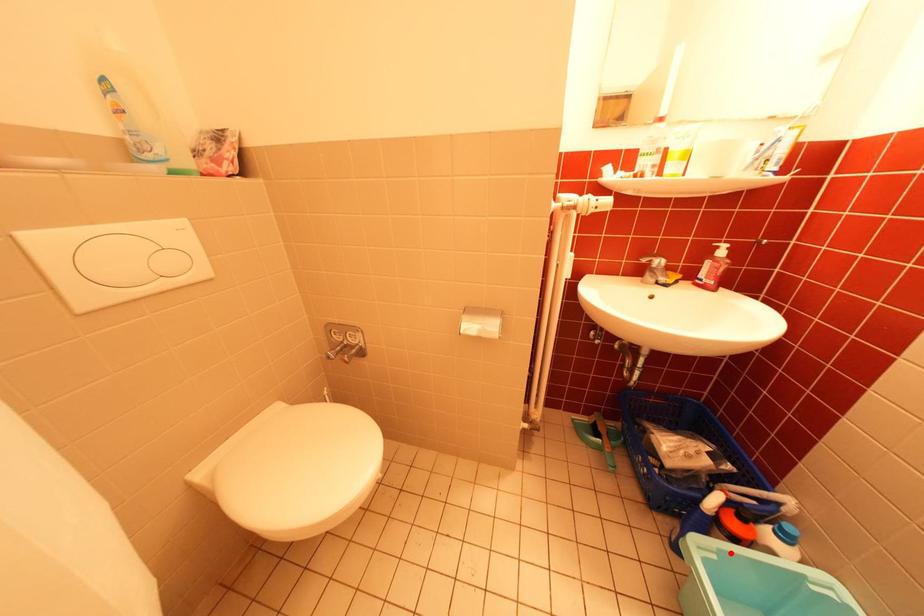
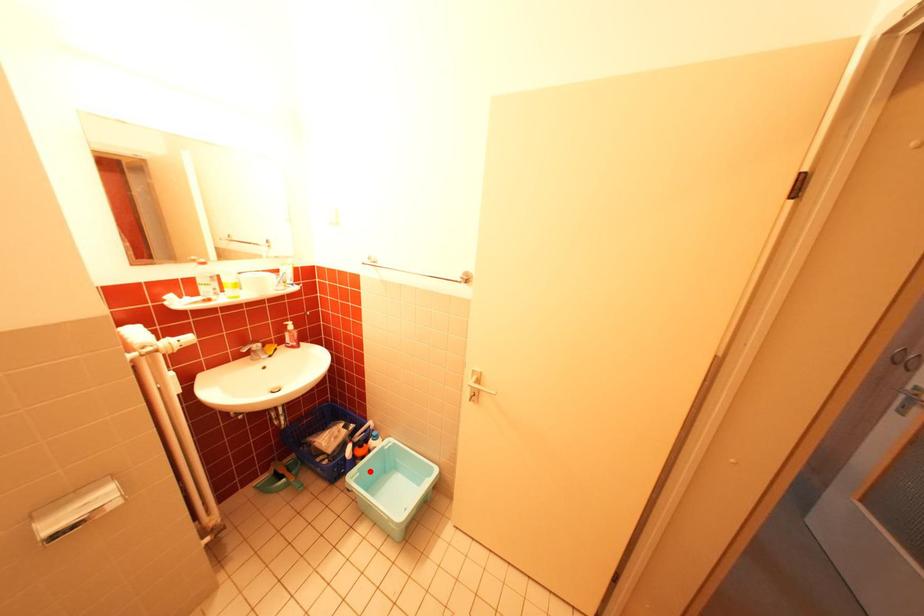
I am providing you with two images of the same scene from different viewpoints. A red point is marked on the first image and another point is marked on the second image. Are the points marked in image1 and image2 representing the same 3D position?

Yes